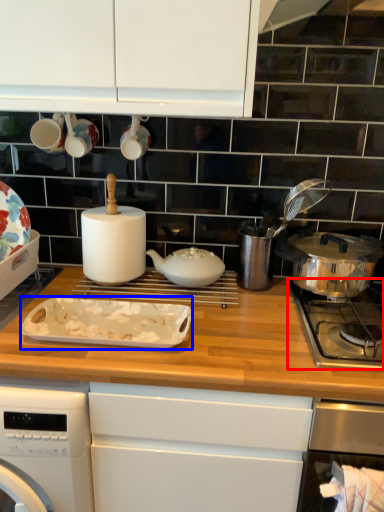
Question: Which of the following is the closest to the observer, gas stove (highlighted by a red box) or kitchen appliance (highlighted by a blue box)?

Choices:
 (A) gas stove
 (B) kitchen appliance

Answer: (A)